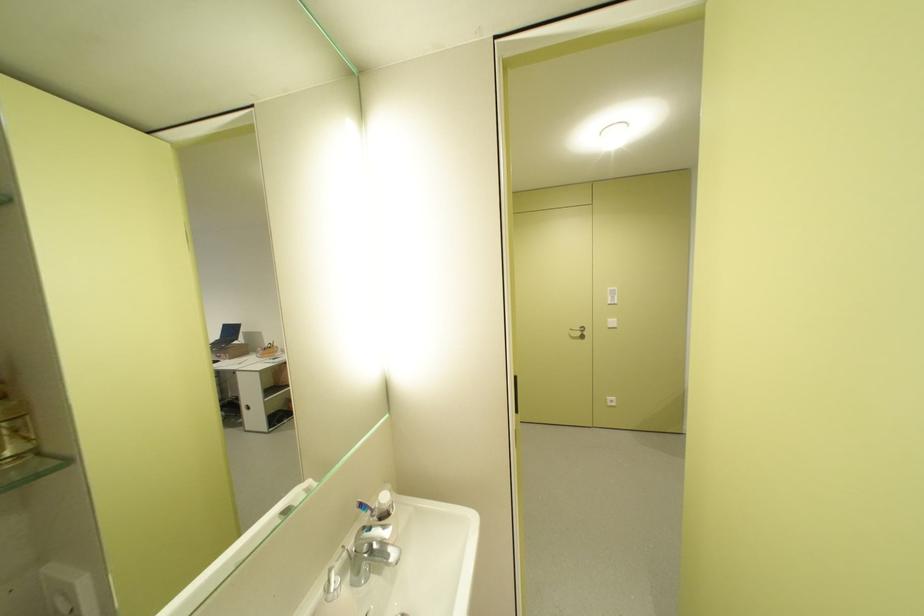
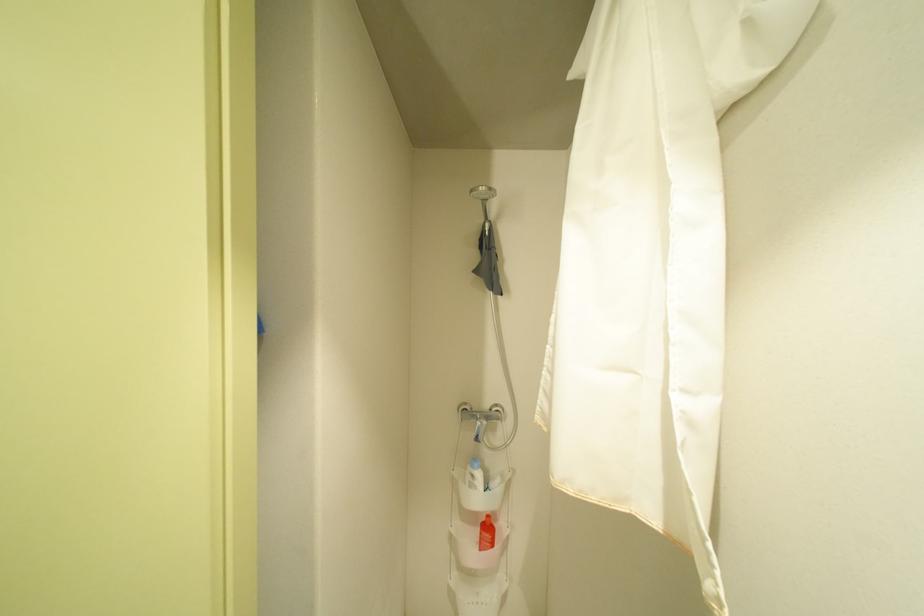
Question: Based on the continuous images, in which direction is the camera rotating? Reply with the corresponding letter.

Choices:
 (A) Left
 (B) Right
 (C) Up
 (D) Down

Answer: (B)